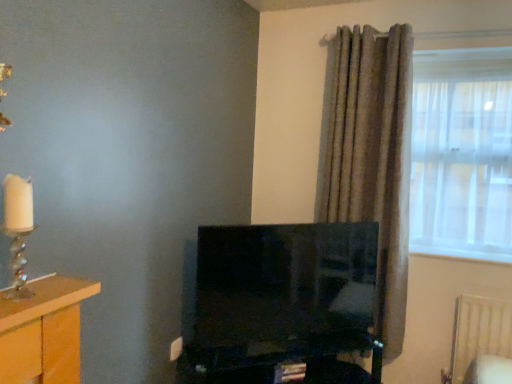
Identify the location of empty space that is ontop of translucent fabric window at right. (459, 56).